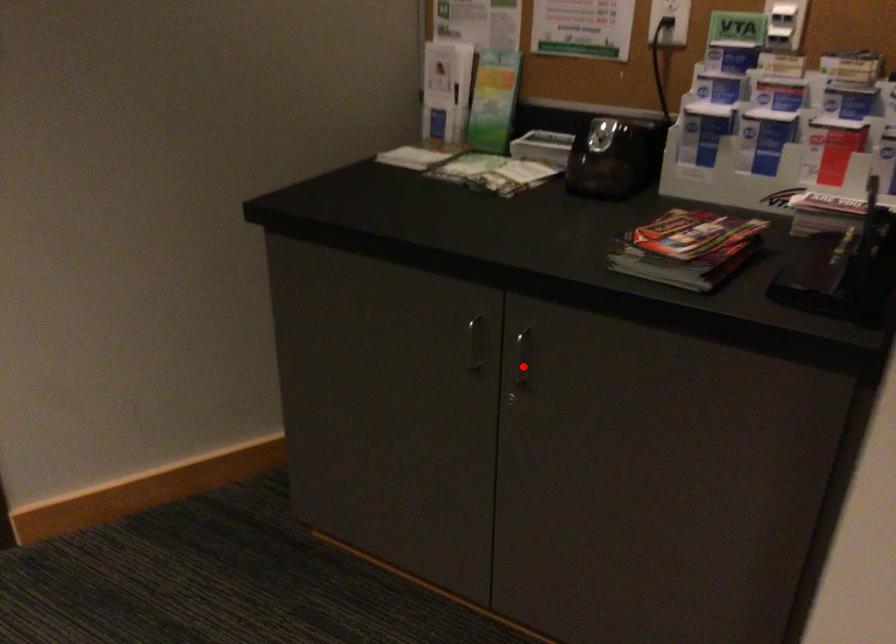
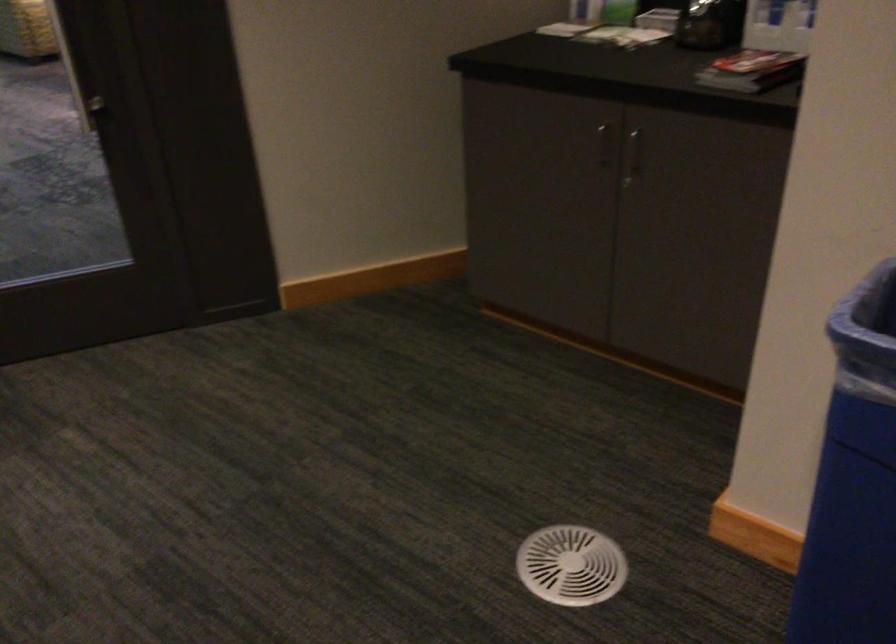
Find the pixel in the second image that matches the highlighted location in the first image.

(633, 155)